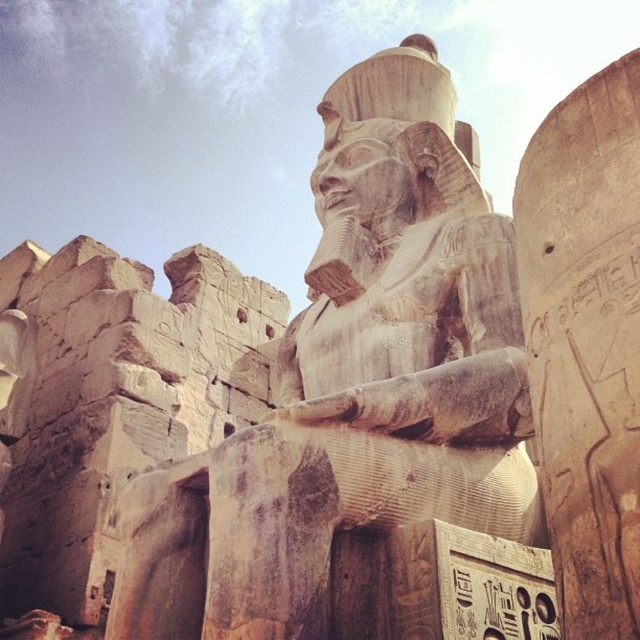
Question: Is carved stone statue at center above smooth stone hieroglyphics at right?

Choices:
 (A) yes
 (B) no

Answer: (A)

Question: Is carved stone statue at center smaller than smooth stone hieroglyphics at right?

Choices:
 (A) no
 (B) yes

Answer: (A)

Question: Which point is farther to the camera?

Choices:
 (A) (406, 125)
 (B) (600, 195)

Answer: (A)

Question: Does carved stone statue at center come behind smooth stone hieroglyphics at right?

Choices:
 (A) yes
 (B) no

Answer: (A)